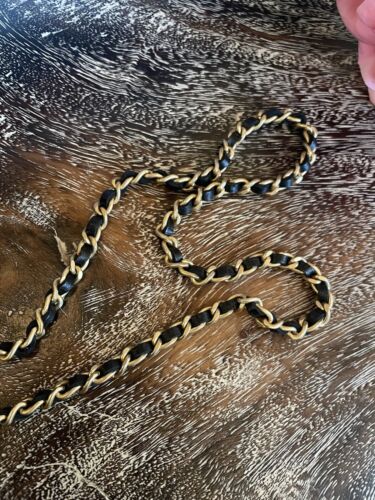
You are a GUI agent. You are given a task and a screenshot of the screen. Output one action in this format:
    pyautogui.click(x=<x>, y=<y>)
    Task: Click on the grey on table
    This screenshot has width=375, height=500.
    Given the screenshot: What is the action you would take?
    pyautogui.click(x=340, y=363), pyautogui.click(x=329, y=394), pyautogui.click(x=243, y=457), pyautogui.click(x=317, y=481), pyautogui.click(x=354, y=491), pyautogui.click(x=353, y=437)